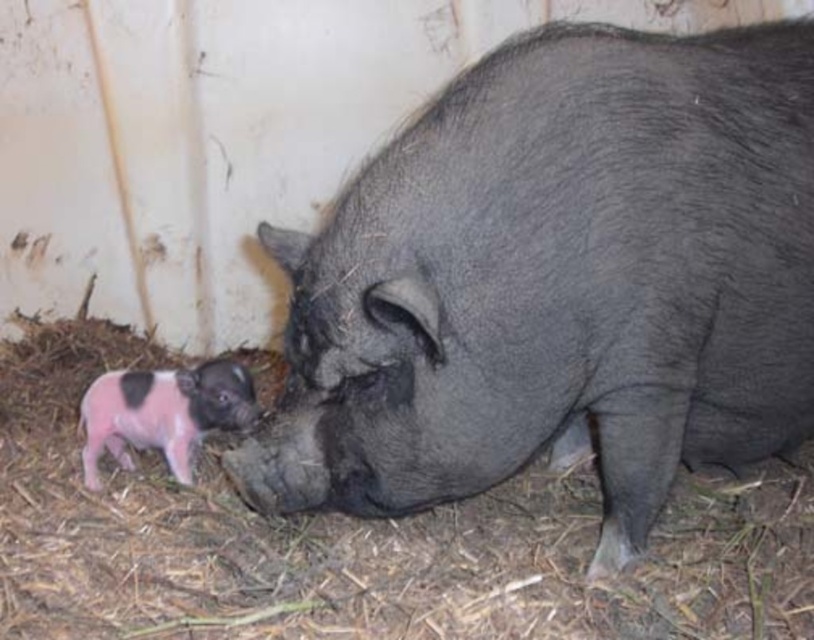
You are a farmer who wants to place a small toy between the shiny black pig at center and the pink soft fur piglet at lower left. Based on their positions, where should you place the toy to ensure it is between them?

The shiny black pig at center is located above the pink soft fur piglet at lower left, so placing the toy between them would require positioning it in the middle area between the lower left and the center, ensuring it is above the pink soft fur piglet at lower left and below the shiny black pig at center.

You are a farmer who needs to place a 30 inch wide feeding trough between the shiny black pig at center and the pink soft fur piglet at lower left. Will the trough fit in the space between them?

The distance between the shiny black pig at center and the pink soft fur piglet at lower left is 26.90 inches. Since the trough is 30 inches wide, it will not fit in the available space.

You are a farmer standing at the origin point in the barn. You need to locate the shiny black pig at center. What are the coordinates where you should look to find it?

The coordinates to locate the shiny black pig at center are at point [558,280].